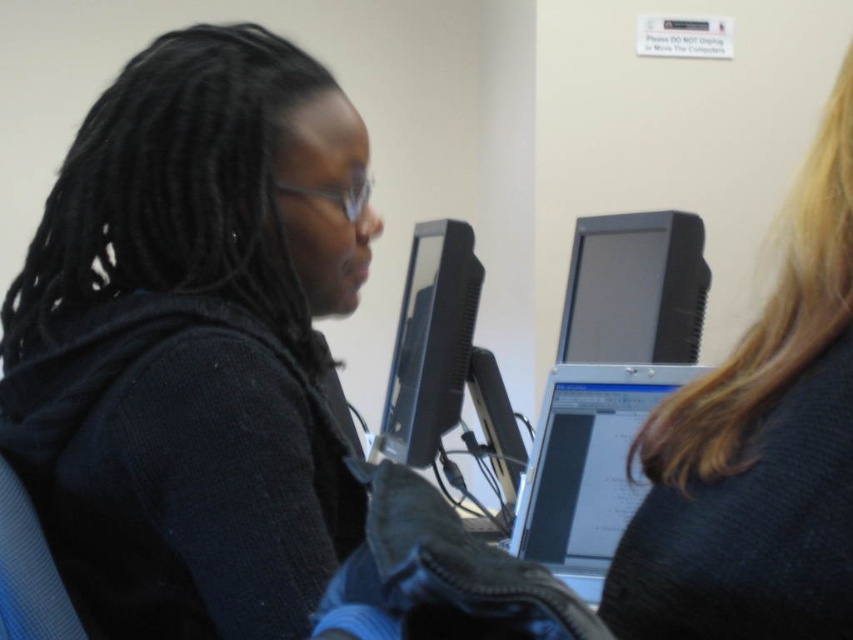
Is point (297, 54) less distant than point (839, 604)?

No, (297, 54) is further to viewer.

Is black matte jacket at left in front of blonde hair at upper right?

Yes, black matte jacket at left is closer to the viewer.

Where is `black matte jacket at left`? The width and height of the screenshot is (853, 640). black matte jacket at left is located at coordinates (195, 346).

Can you confirm if black matte jacket at left is smaller than matte black monitor at upper center?

No, black matte jacket at left is not smaller than matte black monitor at upper center.

Who is more forward, (160, 166) or (614, 260)?

Point (160, 166) is more forward.

Does point (346, 164) come farther from viewer compared to point (596, 246)?

No, (346, 164) is in front of (596, 246).

Find the location of a particular element. Image resolution: width=853 pixels, height=640 pixels. black matte jacket at left is located at coordinates (195, 346).

Between point (566, 381) and point (408, 433), which one is positioned behind?

Point (408, 433)

Which is more to the right, silver metallic laptop at center or matte black monitor at center?

From the viewer's perspective, silver metallic laptop at center appears more on the right side.

The height and width of the screenshot is (640, 853). What do you see at coordinates (585, 467) in the screenshot?
I see `silver metallic laptop at center` at bounding box center [585, 467].

The width and height of the screenshot is (853, 640). In order to click on silver metallic laptop at center in this screenshot , I will do pyautogui.click(x=585, y=467).